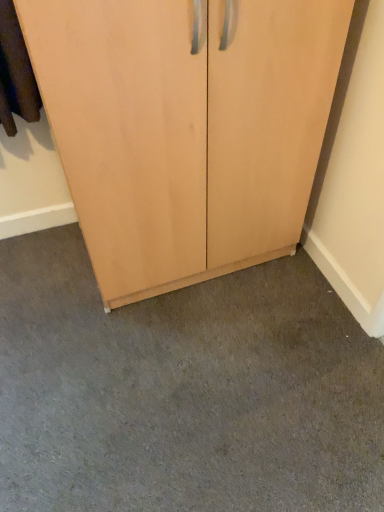
This screenshot has width=384, height=512. In order to click on gray carpet at lower center in this screenshot , I will do `click(183, 391)`.

What do you see at coordinates (183, 391) in the screenshot?
I see `gray carpet at lower center` at bounding box center [183, 391].

In order to face light wood cupboard at center, should I rotate leftwards or rightwards?

A 1.660 degree turn to the left will do.

What is the approximate height of light wood cupboard at center?

light wood cupboard at center is 3.30 feet tall.

Image resolution: width=384 pixels, height=512 pixels. What are the coordinates of `light wood cupboard at center` in the screenshot? It's located at (185, 130).

This screenshot has width=384, height=512. What do you see at coordinates (185, 130) in the screenshot?
I see `light wood cupboard at center` at bounding box center [185, 130].

You are a GUI agent. You are given a task and a screenshot of the screen. Output one action in this format:
    pyautogui.click(x=<x>, y=<y>)
    Task: Click on the gray carpet at lower center
    Image resolution: width=384 pixels, height=512 pixels.
    Given the screenshot: What is the action you would take?
    pyautogui.click(x=183, y=391)

Which is more to the right, light wood cupboard at center or gray carpet at lower center?

gray carpet at lower center is more to the right.

Is light wood cupboard at center closer to the viewer compared to gray carpet at lower center?

Yes.

Does point (180, 89) appear closer or farther from the camera than point (236, 465)?

Point (180, 89) is closer to the camera than point (236, 465).

From the image's perspective, who appears lower, light wood cupboard at center or gray carpet at lower center?

gray carpet at lower center.

From a real-world perspective, is light wood cupboard at center physically located above or below gray carpet at lower center?

light wood cupboard at center is situated higher than gray carpet at lower center in the real world.

Can you confirm if light wood cupboard at center is wider than gray carpet at lower center?

In fact, light wood cupboard at center might be narrower than gray carpet at lower center.

Who is shorter, light wood cupboard at center or gray carpet at lower center?

With less height is gray carpet at lower center.

Does light wood cupboard at center have a larger size compared to gray carpet at lower center?

Correct, light wood cupboard at center is larger in size than gray carpet at lower center.

Is light wood cupboard at center completely or partially outside of gray carpet at lower center?

That's correct, light wood cupboard at center is outside of gray carpet at lower center.

Is light wood cupboard at center far away from gray carpet at lower center?

No, there isn't a large distance between light wood cupboard at center and gray carpet at lower center.

Is gray carpet at lower center at the back of light wood cupboard at center?

light wood cupboard at center is not turned away from gray carpet at lower center.

How distant is light wood cupboard at center from gray carpet at lower center?

light wood cupboard at center and gray carpet at lower center are 20.19 inches apart from each other.

The width and height of the screenshot is (384, 512). Identify the location of cupboard lying above the gray carpet at lower center (from the image's perspective). (185, 130).

Considering the relative positions of gray carpet at lower center and light wood cupboard at center in the image provided, is gray carpet at lower center to the left of light wood cupboard at center from the viewer's perspective?

Incorrect, gray carpet at lower center is not on the left side of light wood cupboard at center.

Which object is further away from the camera, gray carpet at lower center or light wood cupboard at center?

gray carpet at lower center is further from the camera.

Considering the positions of points (286, 373) and (43, 37), is point (286, 373) closer to camera compared to point (43, 37)?

That is False.

From the image's perspective, is gray carpet at lower center below light wood cupboard at center?

Correct, gray carpet at lower center appears lower than light wood cupboard at center in the image.

From a real-world perspective, who is located higher, gray carpet at lower center or light wood cupboard at center?

From a 3D spatial view, light wood cupboard at center is above.

Can you confirm if gray carpet at lower center is thinner than light wood cupboard at center?

In fact, gray carpet at lower center might be wider than light wood cupboard at center.

Can you confirm if gray carpet at lower center is taller than light wood cupboard at center?

No.

Based on their sizes in the image, would you say gray carpet at lower center is bigger or smaller than light wood cupboard at center?

gray carpet at lower center is smaller than light wood cupboard at center.

Would you say gray carpet at lower center is outside light wood cupboard at center?

Yes, gray carpet at lower center is not within light wood cupboard at center.

Is gray carpet at lower center beside light wood cupboard at center?

gray carpet at lower center and light wood cupboard at center are clearly separated.

Could you tell me if gray carpet at lower center is facing light wood cupboard at center?

No, gray carpet at lower center is not facing towards light wood cupboard at center.

What's the angular difference between gray carpet at lower center and light wood cupboard at center's facing directions?

The angular difference between gray carpet at lower center and light wood cupboard at center is 88.8 degrees.

This screenshot has width=384, height=512. I want to click on cupboard on the left of gray carpet at lower center, so click(185, 130).

This screenshot has height=512, width=384. What are the coordinates of `concrete beneath the light wood cupboard at center (from a real-world perspective)` in the screenshot? It's located at (183, 391).

Where is `cupboard in front of the gray carpet at lower center`? This screenshot has height=512, width=384. cupboard in front of the gray carpet at lower center is located at coordinates (185, 130).